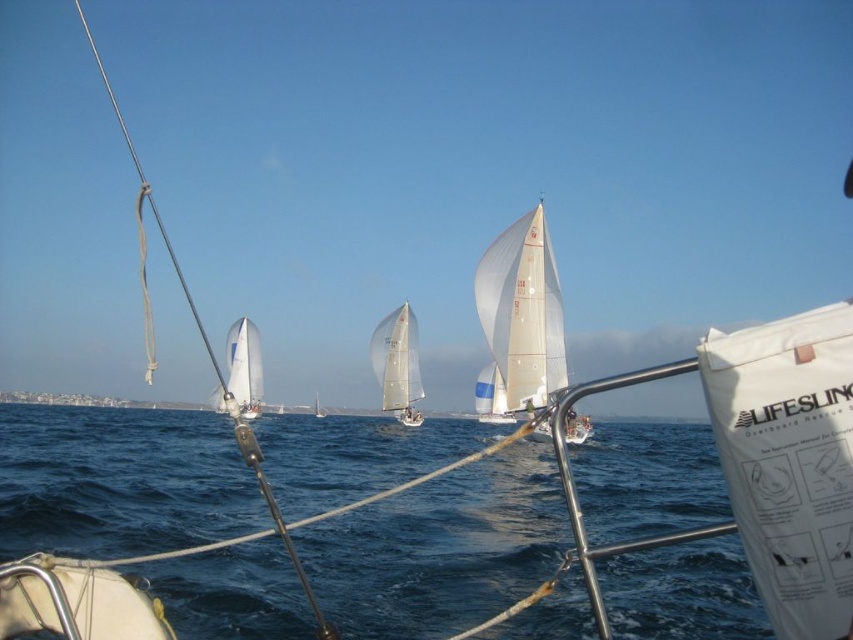
Measure the distance between blue water at center and white sailboat at center.

blue water at center and white sailboat at center are 84.87 feet apart from each other.

Is blue water at center above white sailboat at center?

Actually, blue water at center is below white sailboat at center.

At what (x,y) coordinates should I click in order to perform the action: click on blue water at center. Please return your answer as a coordinate pair (x, y). This screenshot has height=640, width=853. Looking at the image, I should click on (440, 548).

Locate an element on the screen. Image resolution: width=853 pixels, height=640 pixels. blue water at center is located at coordinates [x=440, y=548].

Can you confirm if blue water at center is taller than transparent sailboat at center?

Incorrect, blue water at center's height is not larger of transparent sailboat at center's.

How far apart are blue water at center and transparent sailboat at center?

blue water at center is 117.10 feet away from transparent sailboat at center.

Which is behind, point (581, 624) or point (369, 349)?

The point (369, 349) is more distant.

At what (x,y) coordinates should I click in order to perform the action: click on blue water at center. Please return your answer as a coordinate pair (x, y). The image size is (853, 640). Looking at the image, I should click on (440, 548).

Who is positioned more to the right, blue water at center or white sailboat at left?

blue water at center is more to the right.

Does blue water at center appear under white sailboat at left?

Correct, blue water at center is located below white sailboat at left.

Does point (680, 506) lie behind point (215, 397)?

No, (680, 506) is in front of (215, 397).

This screenshot has height=640, width=853. I want to click on blue water at center, so click(x=440, y=548).